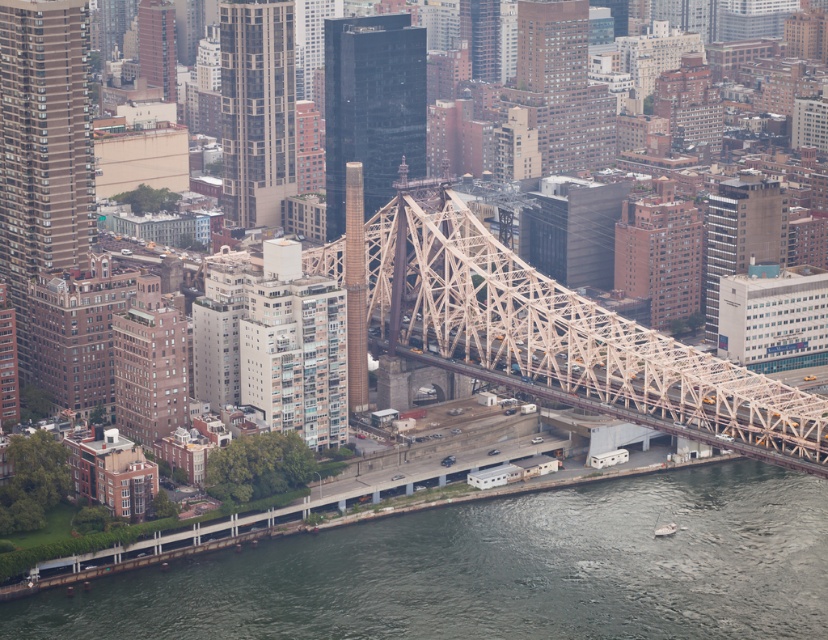
Which of these two, greenish-gray water at lower center or white metal bridge at center, stands taller?

Standing taller between the two is white metal bridge at center.

Where is `greenish-gray water at lower center`? This screenshot has height=640, width=828. greenish-gray water at lower center is located at coordinates (497, 570).